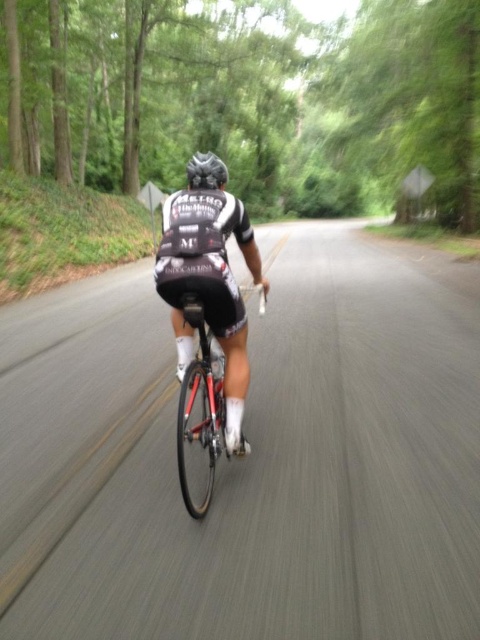
You are a photographer standing at the side of the road with your camera. You want to capture a clear photo of the cyclist wearing the black matte cycling jersey at center. Considering the distance between you and the cyclist, can you take the photo without the cyclist moving out of frame?

The black matte cycling jersey at center and camera are 9.98 feet apart. Since the distance is relatively close, you can take the photo without the cyclist moving out of frame as long as you adjust your timing and focus appropriately.

From the picture: You are a photographer trying to capture the cyclist from the front. You notice the shiny red bicycle at center and the black matte helmet at center. Which object should you focus on to ensure the cyclist is in sharp focus?

You should focus on the shiny red bicycle at center because it is closer to the viewer than the black matte helmet at center, ensuring the cyclist is in sharp focus.

You are a photographer trying to capture the cyclist wearing the black matte cycling jersey at center. If your camera is focused on the center of the image, which is at point coordinates of 0.5, 0.5, will the cyclist be in focus?

The black matte cycling jersey at center is located at point coordinates of (210, 284), which is slightly left and below the center point of (240, 320). Therefore, the cyclist wearing the black matte cycling jersey at center will not be perfectly centered in the frame, but they will still be close enough to the center to be in focus if the camera is focused there.